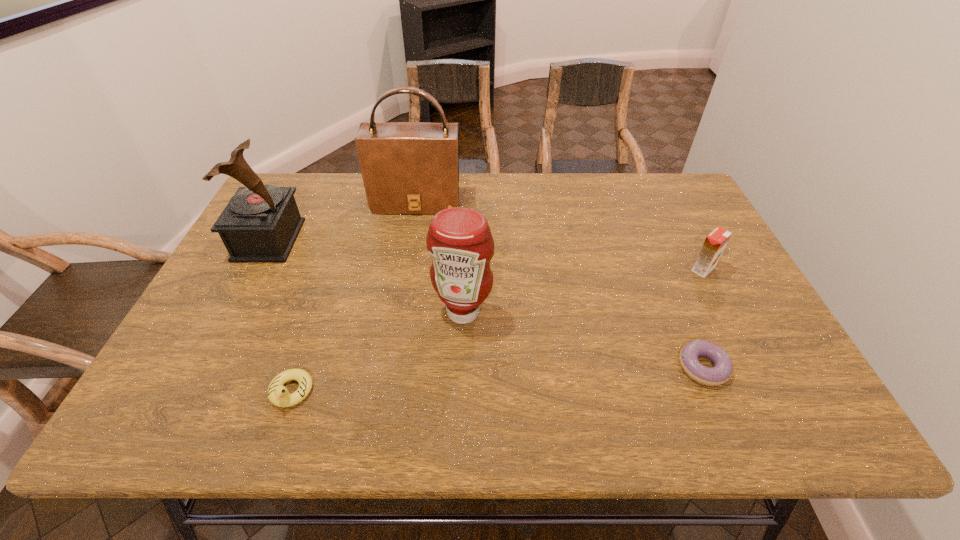
I want to click on free spot that satisfies the following two spatial constraints: 1. on the front flap of the orange juice; 2. on the right side of the shoulder bag, so click(x=405, y=269).

The height and width of the screenshot is (540, 960). In order to click on vacant space that satisfies the following two spatial constraints: 1. at the horn opening of the phonograph_record; 2. on the right side of the second object from right to left in this screenshot , I will do `click(203, 367)`.

You are a GUI agent. You are given a task and a screenshot of the screen. Output one action in this format:
    pyautogui.click(x=<x>, y=<y>)
    Task: Click on the vacant space that satisfies the following two spatial constraints: 1. on the front flap of the shoulder bag; 2. on the right side of the doughnut
    
    Given the screenshot: What is the action you would take?
    coord(388,367)